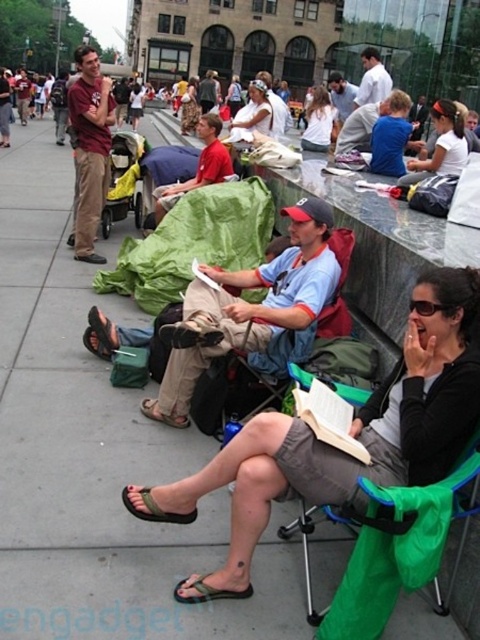
Question: Does green fabric chair at lower right have a lesser width compared to white cotton shirt at center?

Choices:
 (A) no
 (B) yes

Answer: (B)

Question: Based on their relative distances, which object is farther from the green fabric chair at lower right?

Choices:
 (A) matte white shirt at upper center
 (B) green fabric sandal at lower left

Answer: (A)

Question: Which object is the closest to the matte white shirt at upper center?

Choices:
 (A) green fabric sandal at lower left
 (B) green fabric sandal at lower center

Answer: (A)

Question: Does gray fabric shorts at center appear over matte white shirt at upper center?

Choices:
 (A) yes
 (B) no

Answer: (B)

Question: Which point is farther to the camera?

Choices:
 (A) pyautogui.click(x=340, y=305)
 (B) pyautogui.click(x=182, y=580)
 (C) pyautogui.click(x=372, y=456)

Answer: (A)

Question: Can you confirm if green fabric sandal at lower center is smaller than green fabric sandal at lower left?

Choices:
 (A) yes
 (B) no

Answer: (A)